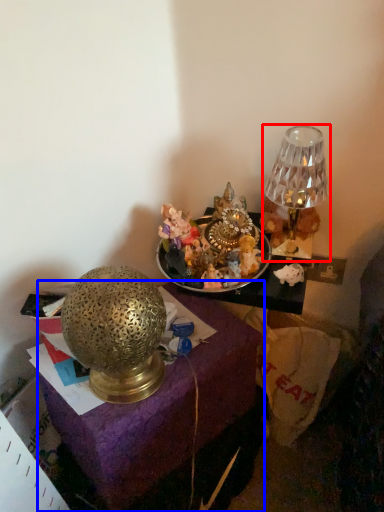
Question: Which of the following is the farthest to the observer, lamp (highlighted by a red box) or furniture (highlighted by a blue box)?

Choices:
 (A) lamp
 (B) furniture

Answer: (A)